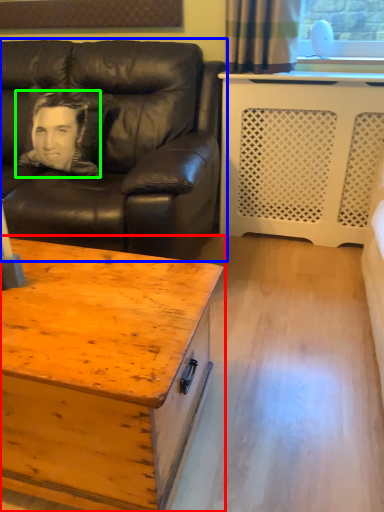
Question: Which object is the farthest from coffee table (highlighted by a red box)? Choose among these: studio couch (highlighted by a blue box) or man (highlighted by a green box).

Choices:
 (A) studio couch
 (B) man

Answer: (B)